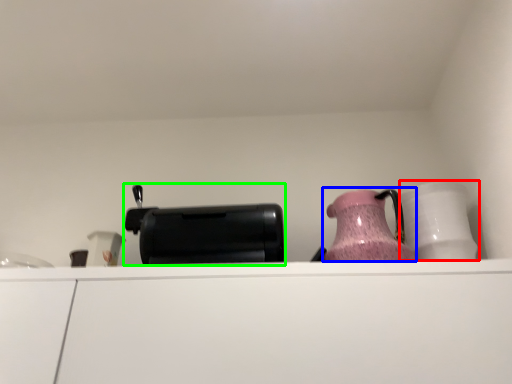
Question: Which object is positioned closest to tableware (highlighted by a red box)? Select from jug (highlighted by a blue box) and appliance (highlighted by a green box).

Choices:
 (A) jug
 (B) appliance

Answer: (A)